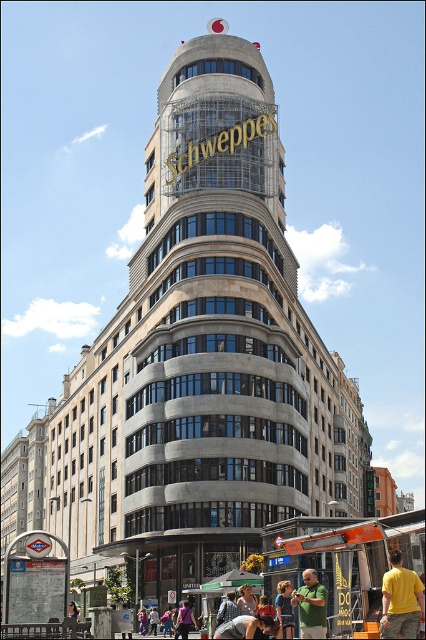
Which is in front, point (416, 627) or point (314, 592)?

Point (416, 627) is in front.

Does yellow cotton shirt at lower right have a lesser height compared to green fabric shirt at center?

Incorrect, yellow cotton shirt at lower right's height does not fall short of green fabric shirt at center's.

Who is more distant from viewer, (391, 628) or (311, 580)?

Positioned behind is point (311, 580).

Find the location of `yellow cotton shirt at lower right`. yellow cotton shirt at lower right is located at coordinates (400, 600).

Is purple fabric dress at center taller than purple fabric dress at lower center?

No, purple fabric dress at center is not taller than purple fabric dress at lower center.

Between purple fabric dress at center and purple fabric dress at lower center, which one appears on the right side from the viewer's perspective?

purple fabric dress at center

Locate an element on the screen. This screenshot has height=640, width=426. purple fabric dress at center is located at coordinates pyautogui.click(x=184, y=620).

Is light brown leather jacket at center behind pink fabric bag at center?

No, light brown leather jacket at center is closer to the viewer.

Who is higher up, light brown leather jacket at center or pink fabric bag at center?

light brown leather jacket at center is higher up.

Between point (244, 611) and point (166, 624), which one is positioned behind?

Positioned behind is point (166, 624).

This screenshot has width=426, height=640. In order to click on light brown leather jacket at center in this screenshot , I will do `click(247, 600)`.